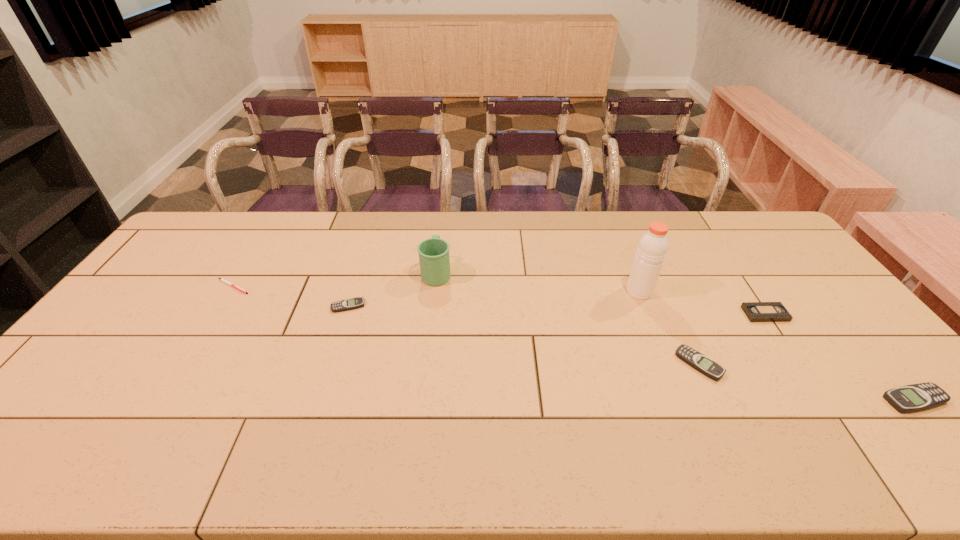
If we want them evenly spaced by inserting an extra beeper among them, please locate a free spot for this new beeper. Please provide its 2D coordinates. Your answer should be formatted as a tuple, i.e. [(x, y)], where the tuple contains the x and y coordinates of a point satisfying the conditions above.

[(513, 333)]